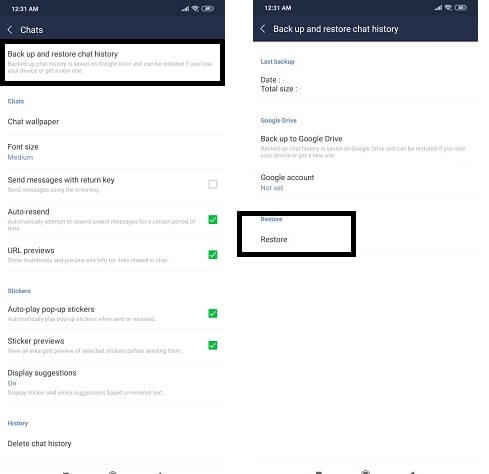
In order to click on wallpaper in this screenshot , I will do `click(30, 121)`.